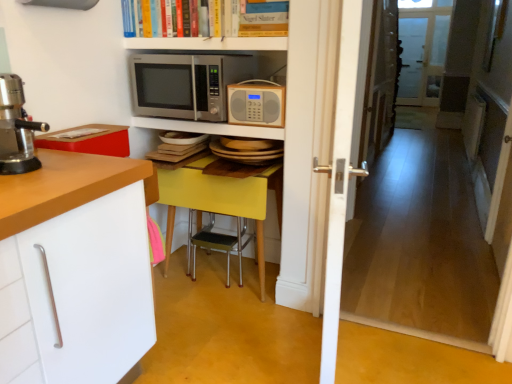
Based on the photo, what is the approximate height of metallic espresso machine at left?

It is 11.98 inches.

Locate an element on the screen. The image size is (512, 384). wooden floor at center is located at coordinates (435, 246).

What is the approximate height of white glossy shelf at upper center, arranged as the 2th shelf when ordered from the bottom?

The height of white glossy shelf at upper center, arranged as the 2th shelf when ordered from the bottom, is 5.35 centimeters.

What do you see at coordinates (186, 84) in the screenshot? Image resolution: width=512 pixels, height=384 pixels. I see `satin silver microwave at upper center, the first microwave oven when ordered from left to right` at bounding box center [186, 84].

Where is `metallic silver microwave at upper center, marked as the second shelf in a top-to-bottom arrangement`? The image size is (512, 384). metallic silver microwave at upper center, marked as the second shelf in a top-to-bottom arrangement is located at coordinates (209, 128).

Is yellow matte table at center at the back of satin silver microwave at upper center, the first microwave oven when ordered from left to right?

No, satin silver microwave at upper center, the first microwave oven when ordered from left to right,'s orientation is not away from yellow matte table at center.

Consider the image. Does satin silver microwave at upper center, the first microwave oven when ordered from left to right, have a larger size compared to yellow matte table at center?

Actually, satin silver microwave at upper center, the first microwave oven when ordered from left to right, might be smaller than yellow matte table at center.

Which is in front, satin silver microwave at upper center, the first microwave oven when ordered from left to right, or yellow matte table at center?

satin silver microwave at upper center, the first microwave oven when ordered from left to right.

Does point (223, 120) come farther from viewer compared to point (246, 50)?

No.

Is satin silver microwave at upper center, the first microwave oven when ordered from left to right, turned away from white glossy shelf at upper center, which is counted as the 1th shelf, starting from the top?

That's not correct — satin silver microwave at upper center, the first microwave oven when ordered from left to right, is not looking away from white glossy shelf at upper center, which is counted as the 1th shelf, starting from the top.

Considering the relative positions of satin silver microwave at upper center, the first microwave oven when ordered from left to right, and white glossy shelf at upper center, which is counted as the 1th shelf, starting from the top, in the image provided, is satin silver microwave at upper center, the first microwave oven when ordered from left to right, to the right of white glossy shelf at upper center, which is counted as the 1th shelf, starting from the top, from the viewer's perspective?

Incorrect, satin silver microwave at upper center, the first microwave oven when ordered from left to right, is not on the right side of white glossy shelf at upper center, which is counted as the 1th shelf, starting from the top.

Is satin silver microwave at upper center, positioned as the second microwave oven in right-to-left order, positioned far away from white glossy shelf at upper center, arranged as the 2th shelf when ordered from the bottom?

No, there isn't a large distance between satin silver microwave at upper center, positioned as the second microwave oven in right-to-left order, and white glossy shelf at upper center, arranged as the 2th shelf when ordered from the bottom.

From the image's perspective, is wooden floor at center on satin silver microwave at upper center, positioned as the second microwave oven in right-to-left order?

Incorrect, from the image's perspective, wooden floor at center is lower than satin silver microwave at upper center, positioned as the second microwave oven in right-to-left order.

Can you see wooden floor at center touching satin silver microwave at upper center, positioned as the second microwave oven in right-to-left order?

No, wooden floor at center is not touching satin silver microwave at upper center, positioned as the second microwave oven in right-to-left order.

Considering the positions of points (501, 322) and (225, 56), is point (501, 322) closer to camera compared to point (225, 56)?

That is True.

Visually, is hardcover book at upper center positioned to the left or to the right of satin silver microwave at upper center, the first microwave oven when ordered from left to right?

hardcover book at upper center is to the right of satin silver microwave at upper center, the first microwave oven when ordered from left to right.

Looking at the image, does hardcover book at upper center seem bigger or smaller compared to satin silver microwave at upper center, positioned as the second microwave oven in right-to-left order?

Considering their sizes, hardcover book at upper center takes up less space than satin silver microwave at upper center, positioned as the second microwave oven in right-to-left order.

How many degrees apart are the facing directions of hardcover book at upper center and metallic silver microwave at upper center, the 1th shelf from the bottom?

The angle between the facing direction of hardcover book at upper center and the facing direction of metallic silver microwave at upper center, the 1th shelf from the bottom, is 1.74 degrees.

From the image's perspective, which shelf is the 2nd one below the hardcover book at upper center? Please provide its 2D coordinates.

[(209, 128)]

Would you say hardcover book at upper center is a long distance from metallic silver microwave at upper center, marked as the second shelf in a top-to-bottom arrangement?

No.

Is wooden radio at center, arranged as the 2th microwave oven when viewed from the left, in contact with metallic espresso machine at left?

No, wooden radio at center, arranged as the 2th microwave oven when viewed from the left, is not next to metallic espresso machine at left.

Is wooden radio at center, placed as the 1th microwave oven when sorted from right to left, facing towards metallic espresso machine at left?

No, wooden radio at center, placed as the 1th microwave oven when sorted from right to left, is not aimed at metallic espresso machine at left.

Which object is wider, wooden radio at center, placed as the 1th microwave oven when sorted from right to left, or metallic espresso machine at left?

metallic espresso machine at left is wider.

Between wooden radio at center, arranged as the 2th microwave oven when viewed from the left, and metallic espresso machine at left, which one is positioned in front?

metallic espresso machine at left is in front.

Is point (159, 176) positioned after point (243, 41)?

Yes, it is.

You are a GUI agent. You are given a task and a screenshot of the screen. Output one action in this format:
    pyautogui.click(x=<x>, y=<y>)
    Task: Click on the table located on the right of white glossy shelf at upper center, which is counted as the 1th shelf, starting from the top
    
    Given the screenshot: What is the action you would take?
    pyautogui.click(x=220, y=201)

Does yellow matte table at center have a smaller size compared to white glossy shelf at upper center, arranged as the 2th shelf when ordered from the bottom?

No, yellow matte table at center is not smaller than white glossy shelf at upper center, arranged as the 2th shelf when ordered from the bottom.

How many degrees apart are the facing directions of yellow matte table at center and white glossy shelf at upper center, which is counted as the 1th shelf, starting from the top?

yellow matte table at center and white glossy shelf at upper center, which is counted as the 1th shelf, starting from the top, are facing 0.374 degrees away from each other.

Locate an element on the screen. table that is behind the satin silver microwave at upper center, positioned as the second microwave oven in right-to-left order is located at coordinates (220, 201).

Find the location of `shelf above the satin silver microwave at upper center, the first microwave oven when ordered from left to right (from a real-world perspective)`. shelf above the satin silver microwave at upper center, the first microwave oven when ordered from left to right (from a real-world perspective) is located at coordinates (208, 43).

When comparing their distances from transparent glass screen door at upper right, does metallic silver microwave at upper center, the 1th shelf from the bottom, or yellow matte table at center seem closer?

Among the two, yellow matte table at center is located nearer to transparent glass screen door at upper right.

Based on their spatial positions, is white wooden door at center or wooden floor at center further from white glossy shelf at upper center, which is counted as the 1th shelf, starting from the top?

wooden floor at center is further to white glossy shelf at upper center, which is counted as the 1th shelf, starting from the top.

From the image, which object appears to be nearer to metallic silver microwave at upper center, marked as the second shelf in a top-to-bottom arrangement, wooden radio at center, arranged as the 2th microwave oven when viewed from the left, or transparent glass screen door at upper right?

wooden radio at center, arranged as the 2th microwave oven when viewed from the left, is closer to metallic silver microwave at upper center, marked as the second shelf in a top-to-bottom arrangement.

Considering their positions, is white glossy shelf at upper center, which is counted as the 1th shelf, starting from the top, positioned closer to metallic espresso machine at left than satin silver microwave at upper center, positioned as the second microwave oven in right-to-left order?

Based on the image, satin silver microwave at upper center, positioned as the second microwave oven in right-to-left order, appears to be nearer to metallic espresso machine at left.

Which object lies further to the anchor point satin silver microwave at upper center, positioned as the second microwave oven in right-to-left order, wooden radio at center, arranged as the 2th microwave oven when viewed from the left, or wooden floor at center?

wooden floor at center is positioned further to the anchor satin silver microwave at upper center, positioned as the second microwave oven in right-to-left order.

Considering their positions, is yellow matte table at center positioned closer to white wooden door at center than white glossy shelf at upper center, which is counted as the 1th shelf, starting from the top?

yellow matte table at center is positioned closer to the anchor white wooden door at center.

From the image, which object appears to be farther from wooden floor at center, wooden radio at center, placed as the 1th microwave oven when sorted from right to left, or hardcover book at upper center?

hardcover book at upper center is positioned further to the anchor wooden floor at center.

From the image, which object appears to be farther from metallic espresso machine at left, satin silver microwave at upper center, the first microwave oven when ordered from left to right, or white glossy shelf at upper center, arranged as the 2th shelf when ordered from the bottom?

Among the two, white glossy shelf at upper center, arranged as the 2th shelf when ordered from the bottom, is located further to metallic espresso machine at left.

You are a GUI agent. You are given a task and a screenshot of the screen. Output one action in this format:
    pyautogui.click(x=<x>, y=<y>)
    Task: Click on the table between metallic silver microwave at upper center, marked as the second shelf in a top-to-bottom arrangement, and transparent glass screen door at upper right, along the z-axis
    
    Given the screenshot: What is the action you would take?
    click(220, 201)

Find the location of `table situated between metallic espresso machine at left and wooden radio at center, placed as the 1th microwave oven when sorted from right to left, from left to right`. table situated between metallic espresso machine at left and wooden radio at center, placed as the 1th microwave oven when sorted from right to left, from left to right is located at coordinates (220, 201).

This screenshot has height=384, width=512. Find the location of `table between satin silver microwave at upper center, the first microwave oven when ordered from left to right, and wooden floor at center, in the horizontal direction`. table between satin silver microwave at upper center, the first microwave oven when ordered from left to right, and wooden floor at center, in the horizontal direction is located at coordinates (220, 201).

Where is `table situated between white glossy shelf at upper center, which is counted as the 1th shelf, starting from the top, and wooden floor at center from left to right`? table situated between white glossy shelf at upper center, which is counted as the 1th shelf, starting from the top, and wooden floor at center from left to right is located at coordinates (220, 201).